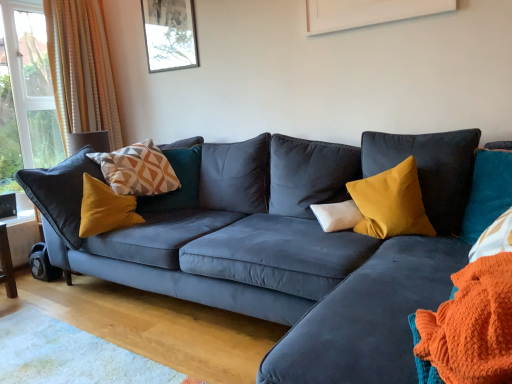
In order to face geometric-patterned fabric pillow at left, marked as the third pillow in a right-to-left arrangement, should I rotate leftwards or rightwards?

You should rotate left by 15.742 degrees.

What do you see at coordinates (337, 215) in the screenshot? I see `white soft cushion at center, which appears as the 2th pillow when viewed from the right` at bounding box center [337, 215].

Locate an element on the screen. This screenshot has height=384, width=512. orange knitted blanket at lower right is located at coordinates (472, 325).

Find the location of a particular element. velvet mustard pillow at center, positioned as the 1th pillow in right-to-left order is located at coordinates (391, 203).

Does geometric-patterned fabric pillow at left, positioned as the first pillow in left-to-right order, turn towards orange striped curtain at left?

No, geometric-patterned fabric pillow at left, positioned as the first pillow in left-to-right order, is not aimed at orange striped curtain at left.

Can you confirm if geometric-patterned fabric pillow at left, marked as the third pillow in a right-to-left arrangement, is positioned to the left of orange striped curtain at left?

In fact, geometric-patterned fabric pillow at left, marked as the third pillow in a right-to-left arrangement, is to the right of orange striped curtain at left.

Which is correct: geometric-patterned fabric pillow at left, positioned as the first pillow in left-to-right order, is inside orange striped curtain at left, or outside of it?

geometric-patterned fabric pillow at left, positioned as the first pillow in left-to-right order, lies outside orange striped curtain at left.

How different are the orientations of geometric-patterned fabric pillow at left, positioned as the first pillow in left-to-right order, and orange striped curtain at left in degrees?

The angular difference between geometric-patterned fabric pillow at left, positioned as the first pillow in left-to-right order, and orange striped curtain at left is 11.3 degrees.

Is orange knitted blanket at lower right not inside white soft cushion at center, which is the second pillow in left-to-right order?

orange knitted blanket at lower right is positioned outside white soft cushion at center, which is the second pillow in left-to-right order.

Does orange knitted blanket at lower right turn towards white soft cushion at center, which is the second pillow in left-to-right order?

No, orange knitted blanket at lower right is not oriented towards white soft cushion at center, which is the second pillow in left-to-right order.

Considering the sizes of objects orange knitted blanket at lower right and white soft cushion at center, which appears as the 2th pillow when viewed from the right, in the image provided, who is smaller, orange knitted blanket at lower right or white soft cushion at center, which appears as the 2th pillow when viewed from the right,?

With smaller size is white soft cushion at center, which appears as the 2th pillow when viewed from the right.

Does point (495, 371) come closer to viewer compared to point (347, 203)?

Yes, point (495, 371) is in front of point (347, 203).

Between velvet mustard pillow at center, positioned as the third pillow in left-to-right order, and orange striped curtain at left, which one has more height?

With more height is orange striped curtain at left.

In the scene shown: Is velvet mustard pillow at center, positioned as the third pillow in left-to-right order, further to camera compared to orange striped curtain at left?

No.

The width and height of the screenshot is (512, 384). Identify the location of curtain lying on the left of velvet mustard pillow at center, positioned as the 1th pillow in right-to-left order. (81, 69).

Considering the relative sizes of velvet mustard pillow at center, positioned as the third pillow in left-to-right order, and orange striped curtain at left in the image provided, is velvet mustard pillow at center, positioned as the third pillow in left-to-right order, smaller than orange striped curtain at left?

Yes.

Is orange knitted blanket at lower right not close to velvet mustard pillow at center, positioned as the third pillow in left-to-right order?

That's right, there is a large distance between orange knitted blanket at lower right and velvet mustard pillow at center, positioned as the third pillow in left-to-right order.

Could you measure the distance between orange knitted blanket at lower right and velvet mustard pillow at center, positioned as the third pillow in left-to-right order?

orange knitted blanket at lower right is 1.00 meters from velvet mustard pillow at center, positioned as the third pillow in left-to-right order.

Which object is further away from the camera, orange knitted blanket at lower right or velvet mustard pillow at center, positioned as the third pillow in left-to-right order?

velvet mustard pillow at center, positioned as the third pillow in left-to-right order.

Is orange knitted blanket at lower right oriented towards velvet mustard pillow at center, positioned as the 1th pillow in right-to-left order?

No, orange knitted blanket at lower right is not aimed at velvet mustard pillow at center, positioned as the 1th pillow in right-to-left order.

Can you tell me how much white soft cushion at center, which appears as the 2th pillow when viewed from the right, and matte glass picture frame at upper center differ in facing direction?

The angular difference between white soft cushion at center, which appears as the 2th pillow when viewed from the right, and matte glass picture frame at upper center is 46.4 degrees.

Between point (318, 212) and point (153, 19), which one is positioned behind?

The point (153, 19) is farther.

Between white soft cushion at center, which is the second pillow in left-to-right order, and matte glass picture frame at upper center, which one has less height?

Standing shorter between the two is white soft cushion at center, which is the second pillow in left-to-right order.

Is velvet mustard pillow at center, positioned as the 1th pillow in right-to-left order, at the back of geometric-patterned fabric pillow at left, positioned as the first pillow in left-to-right order?

No, geometric-patterned fabric pillow at left, positioned as the first pillow in left-to-right order, is not facing away from velvet mustard pillow at center, positioned as the 1th pillow in right-to-left order.

What's the angular difference between geometric-patterned fabric pillow at left, positioned as the first pillow in left-to-right order, and velvet mustard pillow at center, positioned as the third pillow in left-to-right order,'s facing directions?

There is a 77-degree angle between the facing directions of geometric-patterned fabric pillow at left, positioned as the first pillow in left-to-right order, and velvet mustard pillow at center, positioned as the third pillow in left-to-right order.

Would you consider geometric-patterned fabric pillow at left, positioned as the first pillow in left-to-right order, to be distant from velvet mustard pillow at center, positioned as the third pillow in left-to-right order?

geometric-patterned fabric pillow at left, positioned as the first pillow in left-to-right order, is far away from velvet mustard pillow at center, positioned as the third pillow in left-to-right order.

Does geometric-patterned fabric pillow at left, marked as the third pillow in a right-to-left arrangement, have a greater height compared to velvet mustard pillow at center, positioned as the 1th pillow in right-to-left order?

In fact, geometric-patterned fabric pillow at left, marked as the third pillow in a right-to-left arrangement, may be shorter than velvet mustard pillow at center, positioned as the 1th pillow in right-to-left order.

In terms of height, does geometric-patterned fabric pillow at left, marked as the third pillow in a right-to-left arrangement, look taller or shorter compared to white soft cushion at center, which appears as the 2th pillow when viewed from the right?

geometric-patterned fabric pillow at left, marked as the third pillow in a right-to-left arrangement, is taller than white soft cushion at center, which appears as the 2th pillow when viewed from the right.

Between geometric-patterned fabric pillow at left, positioned as the first pillow in left-to-right order, and white soft cushion at center, which is the second pillow in left-to-right order, which one has larger width?

geometric-patterned fabric pillow at left, positioned as the first pillow in left-to-right order.

Is geometric-patterned fabric pillow at left, positioned as the first pillow in left-to-right order, smaller than white soft cushion at center, which appears as the 2th pillow when viewed from the right?

No, geometric-patterned fabric pillow at left, positioned as the first pillow in left-to-right order, is not smaller than white soft cushion at center, which appears as the 2th pillow when viewed from the right.

From a real-world perspective, who is located lower, geometric-patterned fabric pillow at left, positioned as the first pillow in left-to-right order, or white soft cushion at center, which is the second pillow in left-to-right order?

white soft cushion at center, which is the second pillow in left-to-right order, from a real-world perspective.

The width and height of the screenshot is (512, 384). Find the location of `curtain lying above the geometric-patterned fabric pillow at left, positioned as the first pillow in left-to-right order (from the image's perspective)`. curtain lying above the geometric-patterned fabric pillow at left, positioned as the first pillow in left-to-right order (from the image's perspective) is located at coordinates (81, 69).

I want to click on blanket below the white soft cushion at center, which is the second pillow in left-to-right order (from a real-world perspective), so click(472, 325).

Considering their positions, is white soft cushion at center, which is the second pillow in left-to-right order, positioned further to geometric-patterned fabric pillow at left, marked as the third pillow in a right-to-left arrangement, than orange striped curtain at left?

Among the two, white soft cushion at center, which is the second pillow in left-to-right order, is located further to geometric-patterned fabric pillow at left, marked as the third pillow in a right-to-left arrangement.

Considering their positions, is velvet mustard pillow at center, positioned as the 1th pillow in right-to-left order, positioned closer to orange striped curtain at left than white soft cushion at center, which appears as the 2th pillow when viewed from the right?

Based on the image, white soft cushion at center, which appears as the 2th pillow when viewed from the right, appears to be nearer to orange striped curtain at left.

Estimate the real-world distances between objects in this image. Which object is closer to geometric-patterned fabric pillow at left, marked as the third pillow in a right-to-left arrangement, matte glass picture frame at upper center or velvet mustard pillow at center, positioned as the third pillow in left-to-right order?

matte glass picture frame at upper center.

When comparing their distances from matte glass picture frame at upper center, does velvet mustard pillow at center, positioned as the 1th pillow in right-to-left order, or orange striped curtain at left seem closer?

orange striped curtain at left is closer to matte glass picture frame at upper center.

Looking at the image, which one is located closer to velvet mustard pillow at center, positioned as the third pillow in left-to-right order, white soft cushion at center, which is the second pillow in left-to-right order, or geometric-patterned fabric pillow at left, positioned as the first pillow in left-to-right order?

Among the two, white soft cushion at center, which is the second pillow in left-to-right order, is located nearer to velvet mustard pillow at center, positioned as the third pillow in left-to-right order.

Based on their spatial positions, is orange knitted blanket at lower right or white soft cushion at center, which appears as the 2th pillow when viewed from the right, closer to orange striped curtain at left?

white soft cushion at center, which appears as the 2th pillow when viewed from the right, lies closer to orange striped curtain at left than the other object.

Considering their positions, is white soft cushion at center, which is the second pillow in left-to-right order, positioned closer to matte glass picture frame at upper center than velvet mustard pillow at center, positioned as the 1th pillow in right-to-left order?

white soft cushion at center, which is the second pillow in left-to-right order, is closer to matte glass picture frame at upper center.

From the image, which object appears to be nearer to geometric-patterned fabric pillow at left, marked as the third pillow in a right-to-left arrangement, velvet mustard pillow at center, positioned as the 1th pillow in right-to-left order, or orange knitted blanket at lower right?

velvet mustard pillow at center, positioned as the 1th pillow in right-to-left order, lies closer to geometric-patterned fabric pillow at left, marked as the third pillow in a right-to-left arrangement, than the other object.

Where is `pillow between orange striped curtain at left and white soft cushion at center, which appears as the 2th pillow when viewed from the right, from left to right`? The width and height of the screenshot is (512, 384). pillow between orange striped curtain at left and white soft cushion at center, which appears as the 2th pillow when viewed from the right, from left to right is located at coordinates (137, 170).

At what (x,y) coordinates should I click in order to perform the action: click on pillow between geometric-patterned fabric pillow at left, marked as the third pillow in a right-to-left arrangement, and velvet mustard pillow at center, positioned as the third pillow in left-to-right order, in the horizontal direction. Please return your answer as a coordinate pair (x, y). The width and height of the screenshot is (512, 384). Looking at the image, I should click on (337, 215).

Where is `picture frame between orange striped curtain at left and white soft cushion at center, which is the second pillow in left-to-right order, in the horizontal direction`? The width and height of the screenshot is (512, 384). picture frame between orange striped curtain at left and white soft cushion at center, which is the second pillow in left-to-right order, in the horizontal direction is located at coordinates (170, 34).

Locate an element on the screen. This screenshot has height=384, width=512. picture frame between orange striped curtain at left and velvet mustard pillow at center, positioned as the 1th pillow in right-to-left order is located at coordinates (170, 34).